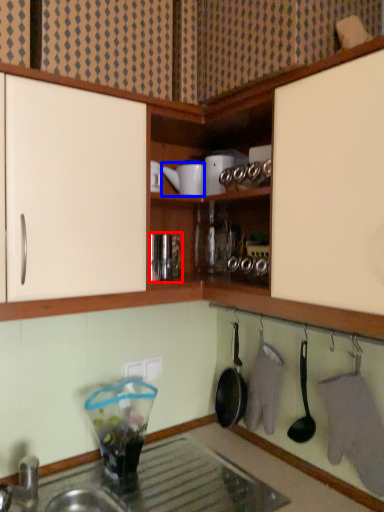
Question: Which of the following is the closest to the observer, appliance (highlighted by a red box) or appliance (highlighted by a blue box)?

Choices:
 (A) appliance
 (B) appliance

Answer: (A)